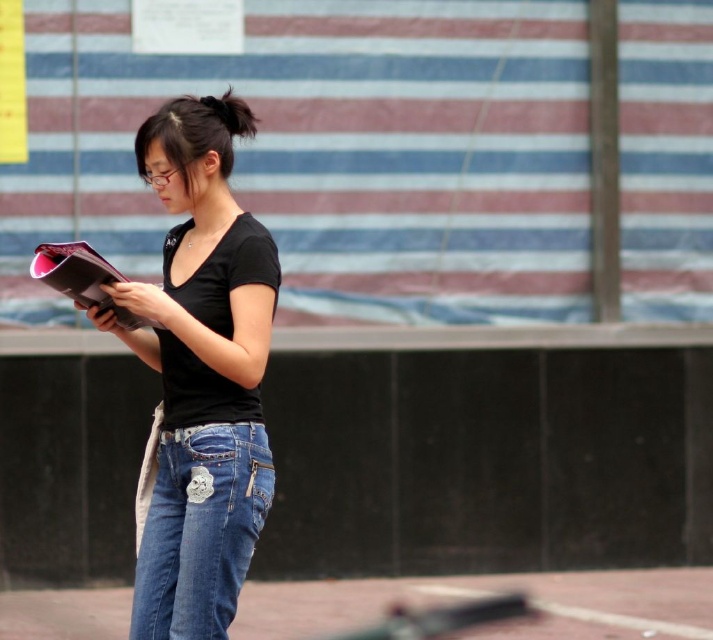
In the scene shown: You are a fashion designer observing the woman in the scene. You need to determine if the black matte shirt at center can be seen above the denim jeans at lower center. Can you confirm this?

The black matte shirt at center is taller than denim jeans at lower center, so yes, the black matte shirt at center can be seen above the denim jeans at lower center.

You are a photographer trying to capture a closeup of the woman reading while avoiding blurring the background. You notice two points in the scene at coordinates point (225, 202) and point (225, 605). Which point should you focus on to ensure the woman remains sharp and the background is blurred?

You should focus on point (225, 202) because it is closer to the viewer than point (225, 605), ensuring the woman stays sharp while the background becomes blurred.

The young woman is wearing a black matte shirt at center and denim jeans at lower center. Which piece of clothing is closer to the viewer?

The black matte shirt at center is closer to the viewer than the denim jeans at lower center because the denim jeans at lower center is behind the black matte shirt at center.